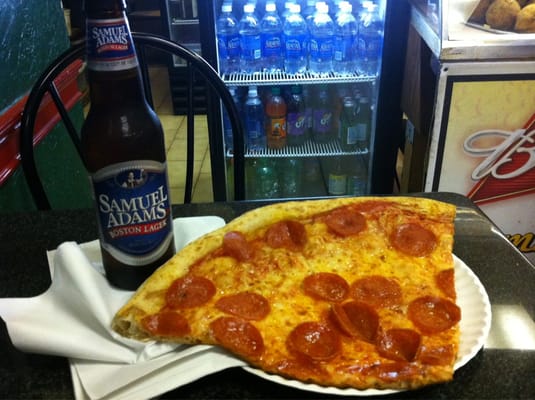
Where is `napkin`? This screenshot has width=535, height=400. napkin is located at coordinates (77, 331), (171, 375), (109, 381).